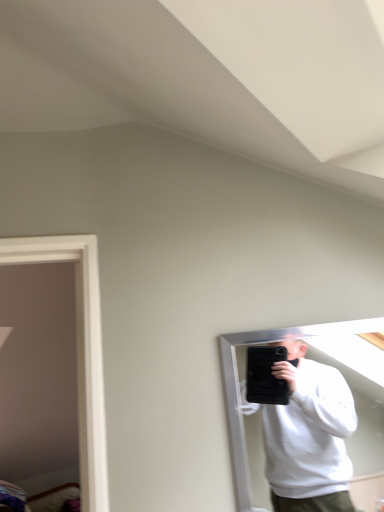
Question: Should I look upward or downward to see black matte tablet at right?

Choices:
 (A) down
 (B) up

Answer: (A)